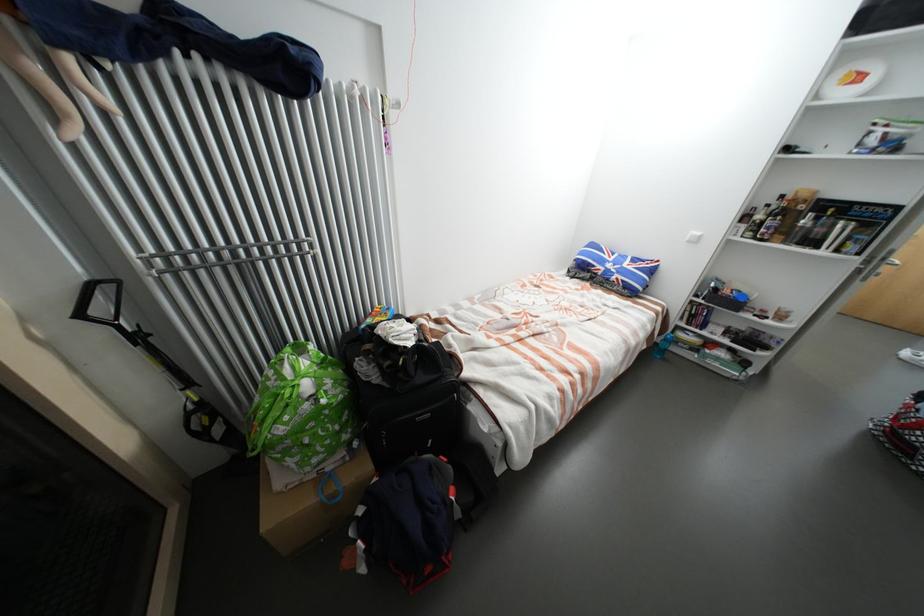
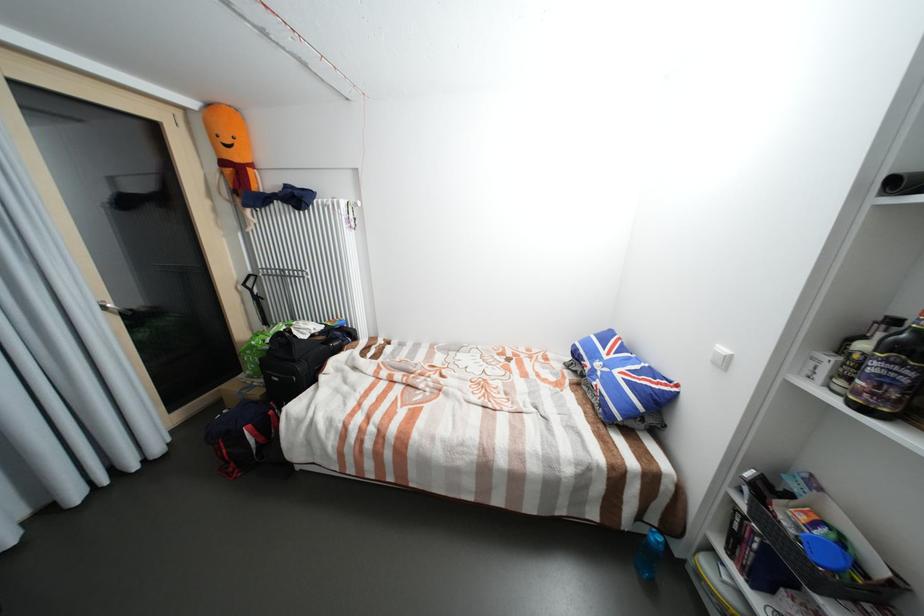
The point at (617, 261) is marked in the first image. Where is the corresponding point in the second image?

(613, 358)